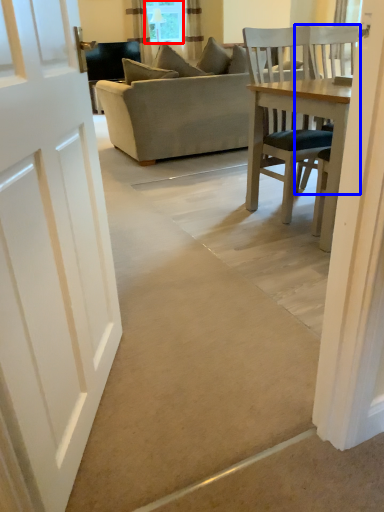
Question: Which point is further to the camera, window screen (highlighted by a red box) or chair (highlighted by a blue box)?

Choices:
 (A) window screen
 (B) chair

Answer: (A)